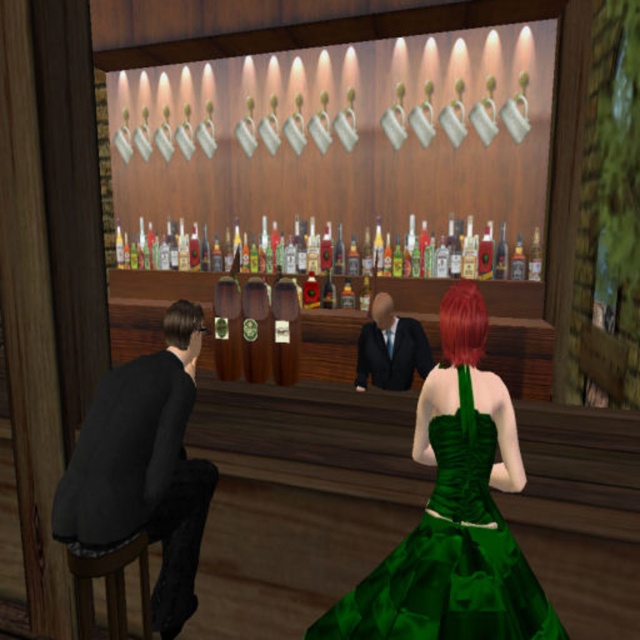
You are a bartender trying to place a new bottle on the bar. The bottle is 10 cm wide. Can you fit it between the shiny glass bottles at center and the brown matte hair at left?

The shiny glass bottles at center might be wider than brown matte hair at left, so the space between them may not be sufficient for a 10 cm wide bottle. Check the actual width before placing it.

You are a bartender at the bar and need to prepare a drink. You see the shiny glass bottles at center and the shiny red hair at center. Which object is larger in size?

The shiny glass bottles at center is bigger than shiny red hair at center.

Looking at this image, you are a bartender who needs to reach both the shiny glass bottles at center and the shiny red hair at center. If you are standing at the bar counter, which object is closer to you?

The shiny glass bottles at center is 4.00 meters from the shiny red hair at center, so the distance between them is 4 meters. Since you are at the bar counter, you need to know which is closer. However, without knowing your exact position relative to both, it is impossible to determine which is closer. The question lacks sufficient spatial information to answer definitively.